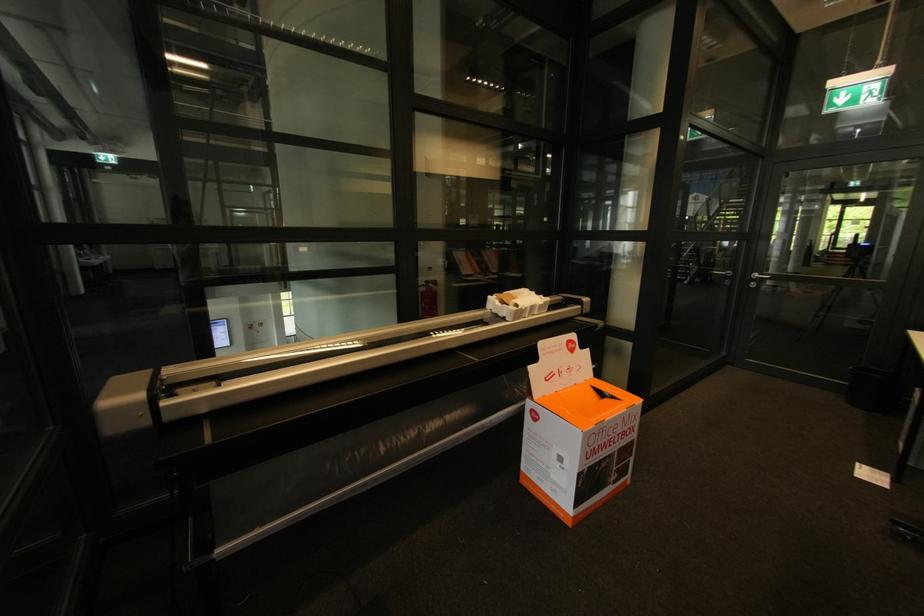
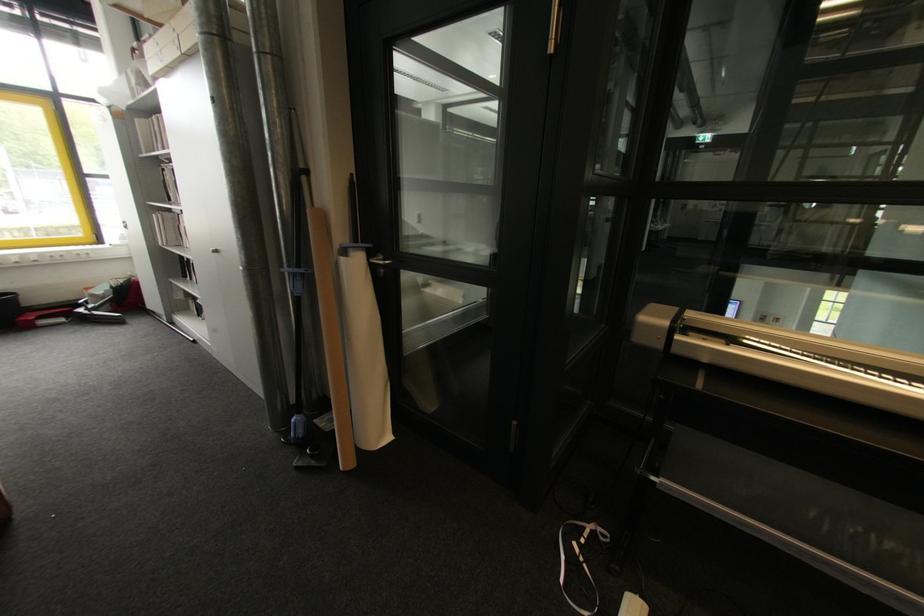
Question: The camera is either moving clockwise (left) or counter-clockwise (right) around the object. The first image is from the beginning of the video and the second image is from the end. Is the camera moving left or right when shooting the video?

Choices:
 (A) Left
 (B) Right

Answer: (B)